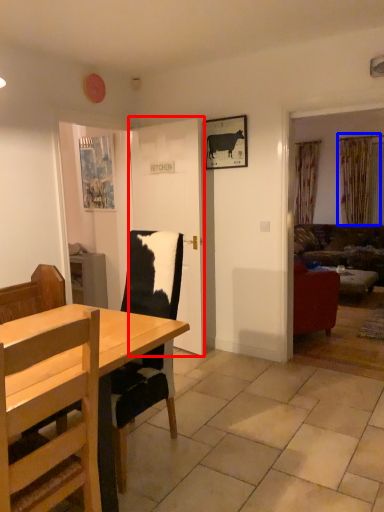
Question: Which point is further to the camera, door (highlighted by a red box) or curtain (highlighted by a blue box)?

Choices:
 (A) door
 (B) curtain

Answer: (B)